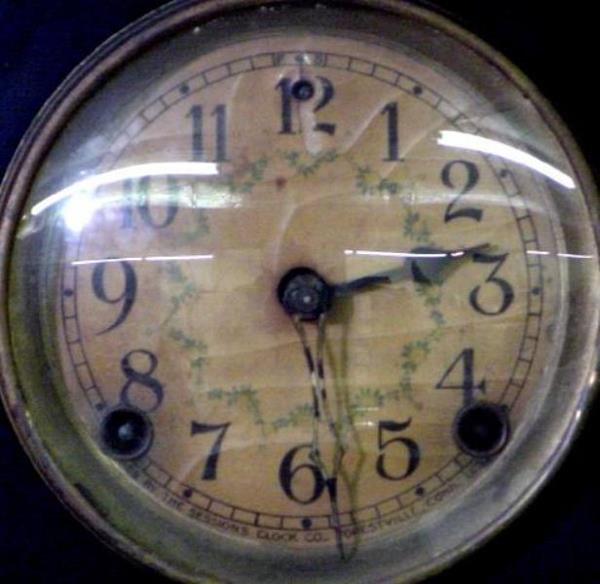
I want to click on clock face, so click(x=323, y=234).